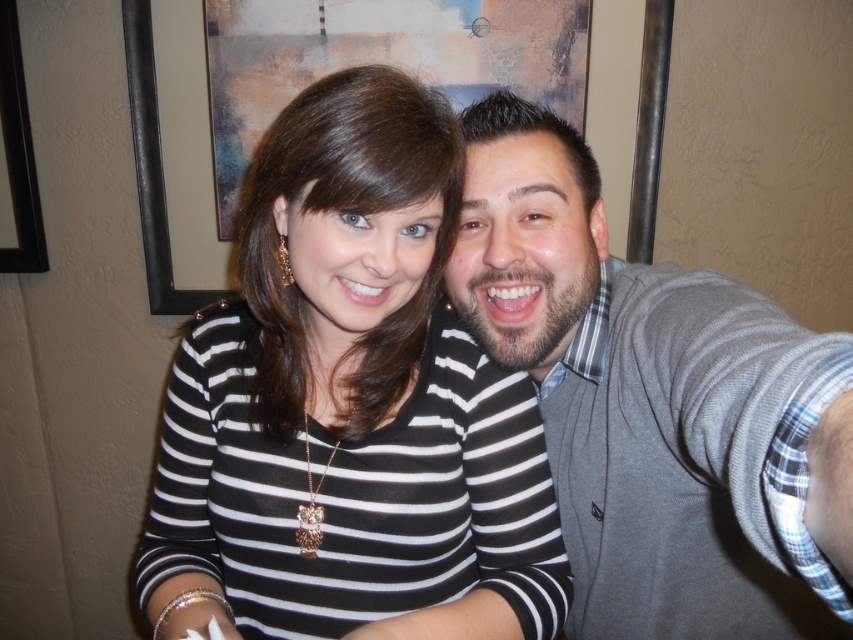
You are taking a selfie with two friends. You notice the black striped shirt at center and the gray sweater at right. Which clothing item is positioned lower on the image?

The black striped shirt at center is positioned below the gray sweater at right, so it is lower in the image.

You are taking a selfie with two people in front of you. You notice the black striped shirt at center and the gray sweater at right. Which clothing item is closer to you?

The black striped shirt at center is closer to you because it is further to the viewer than the gray sweater at right.

You are taking a selfie with a friend and notice the black striped shirt at center in the photo. Based on its position at coordinates point 0.633, 0.411, is it closer to the left or right side of the image?

The black striped shirt at center is located at point (350, 404), which means it is closer to the right side of the image since the x coordinate 0.633 is greater than 0.5.